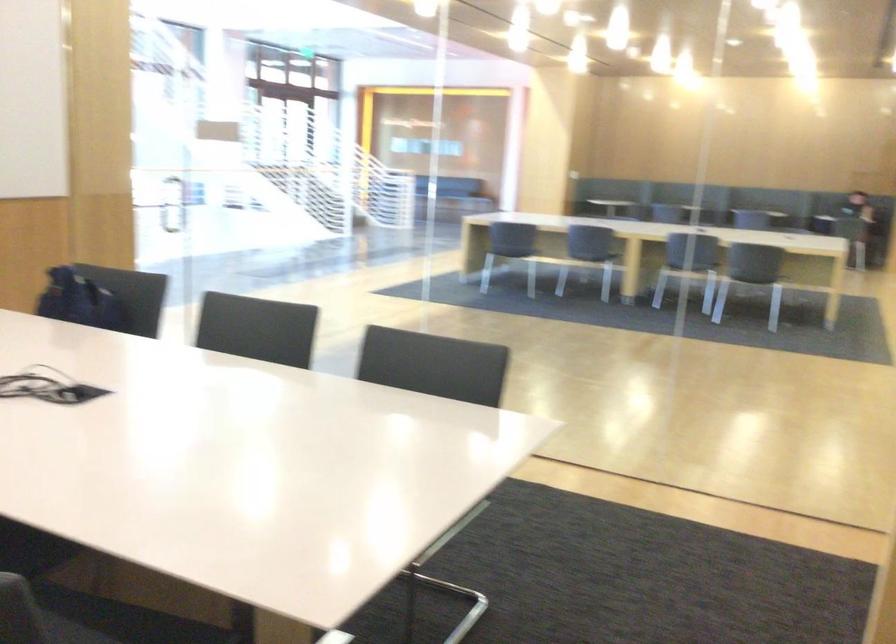
This screenshot has width=896, height=644. Identify the location of glass door handle. (174, 205).